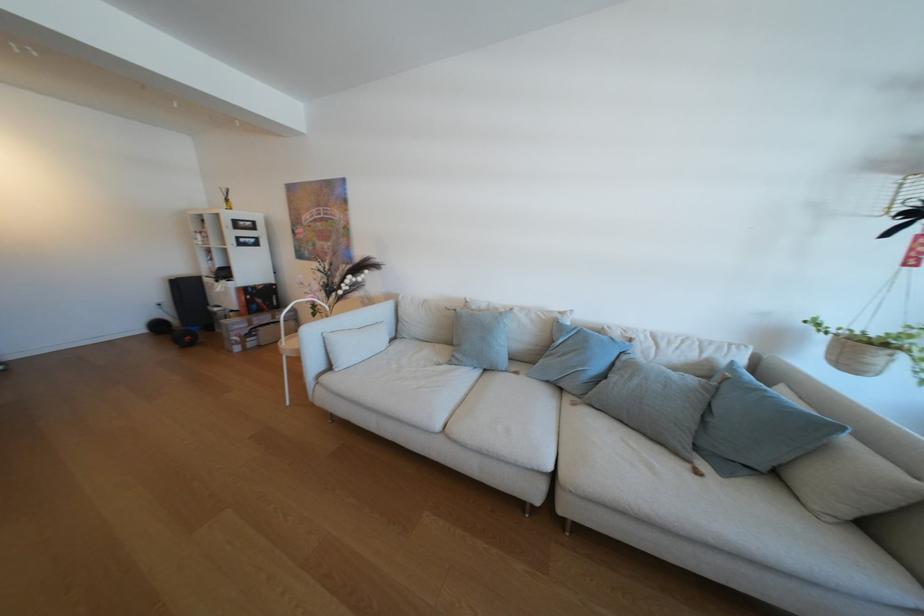
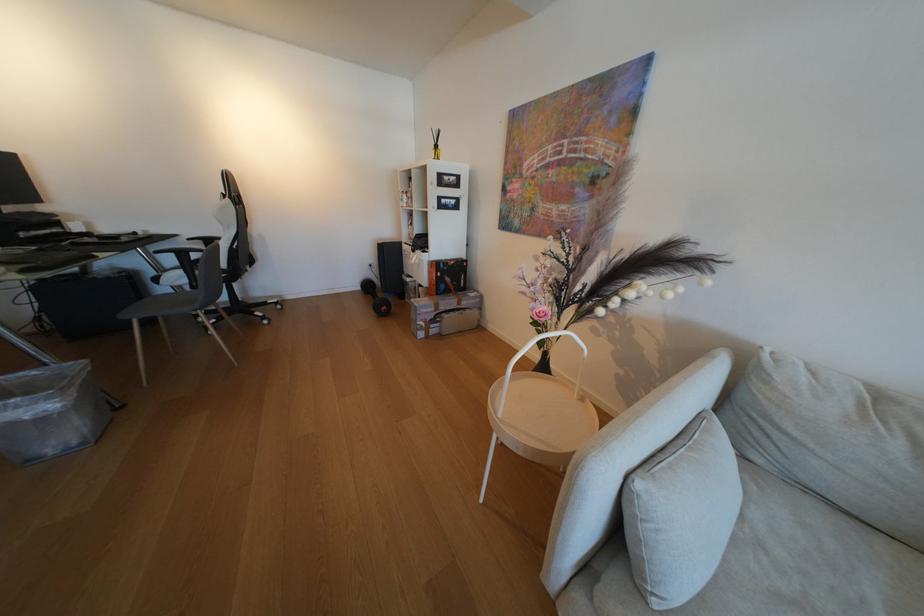
In the second image, find the point that corresponds to the point at 347,371 in the first image.

(665, 604)